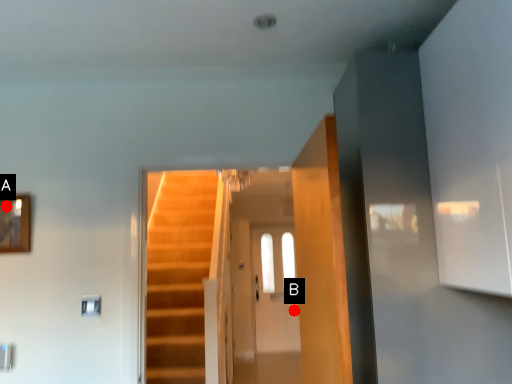
Question: Two points are circled on the image, labeled by A and B beside each circle. Which point is closer to the camera taking this photo?

Choices:
 (A) A is closer
 (B) B is closer

Answer: (A)